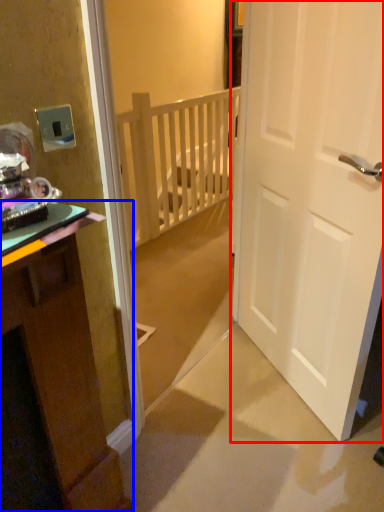
Question: Which object is closer to the camera taking this photo, door (highlighted by a red box) or cabinetry (highlighted by a blue box)?

Choices:
 (A) door
 (B) cabinetry

Answer: (B)